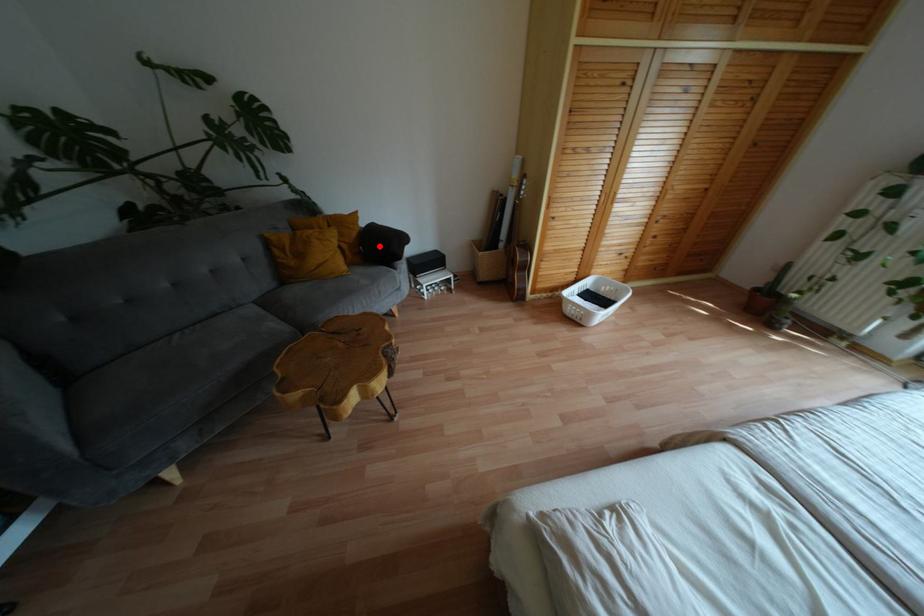
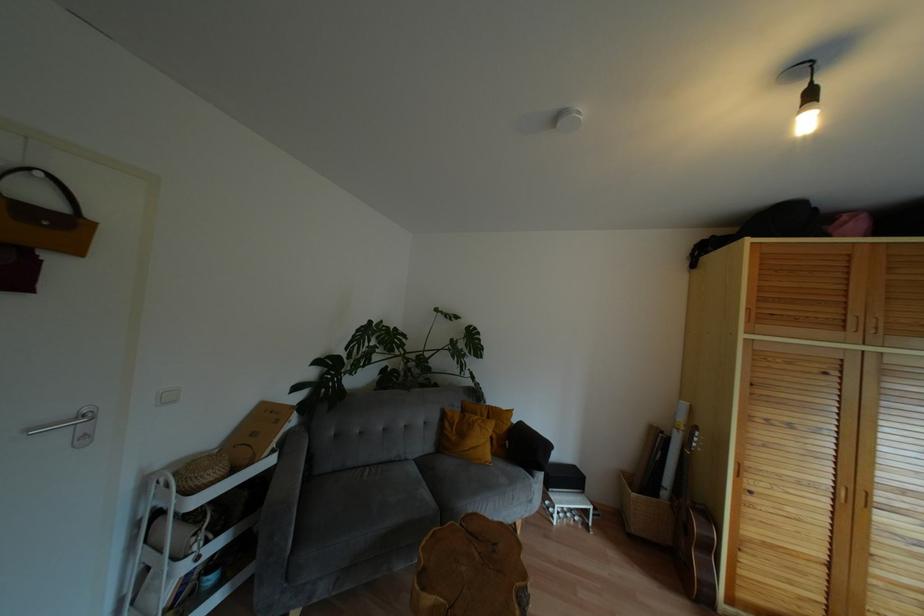
Question: I am providing you with two images of the same scene from different viewpoints. Image1 has a red point marked. In image2, the corresponding 3D location appears at what relative position? Reply with the corresponding letter.

Choices:
 (A) Closer
 (B) Farther

Answer: (B)